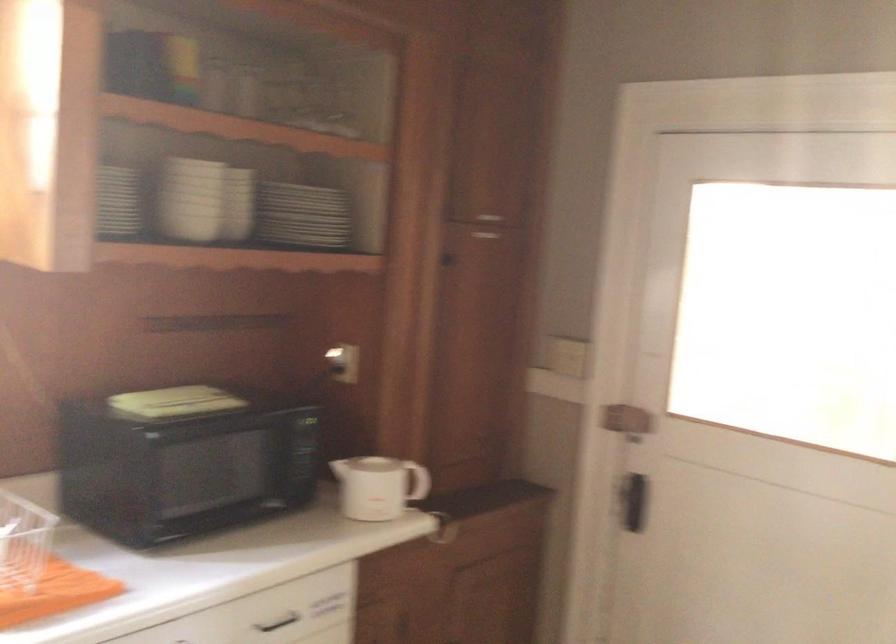
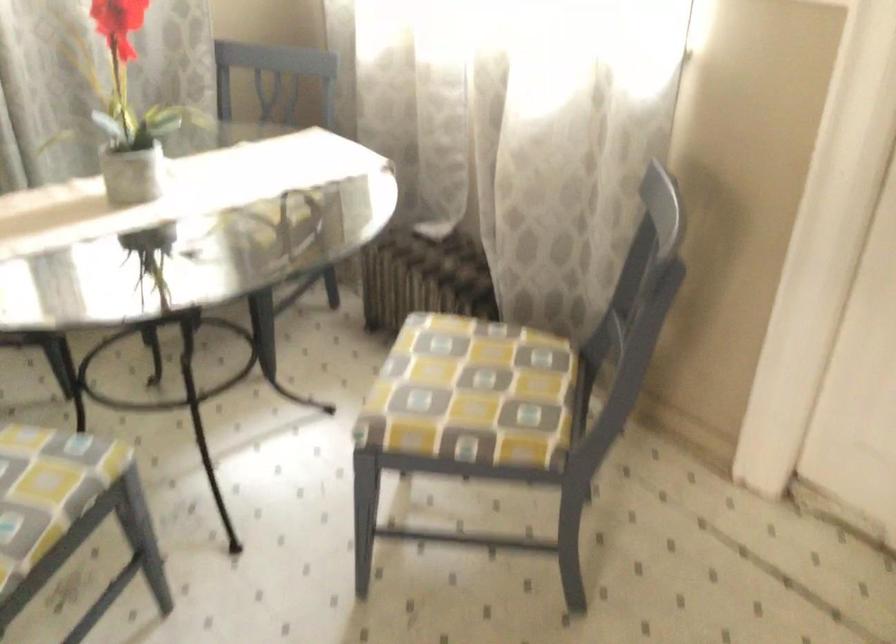
Based on the continuous images, in which direction is the camera rotating?

The camera's rotation is toward right-down.